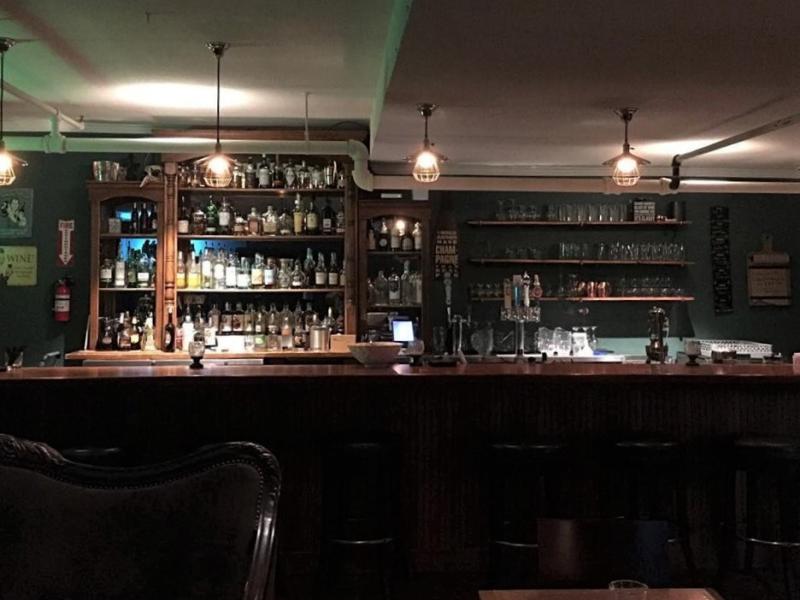
Find the location of a particular element. Image resolution: width=800 pixels, height=600 pixels. pitcher is located at coordinates (586, 341), (564, 346), (550, 335), (488, 341), (442, 337), (470, 341).